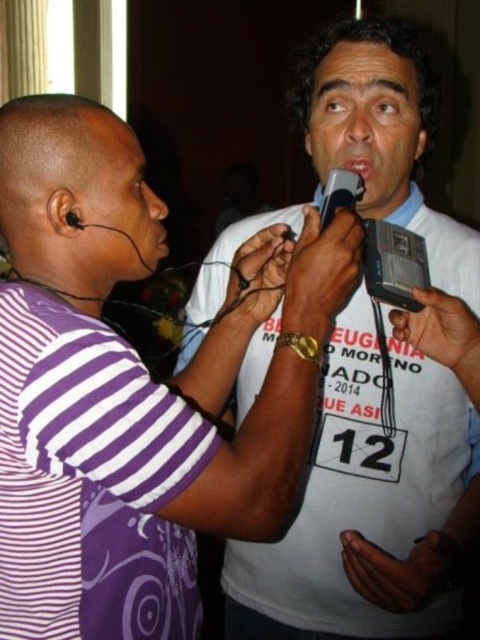
Question: Which object is the farthest from the white fabric shirt at center?

Choices:
 (A) white matte shirt at center
 (B) black plastic microphone at center

Answer: (B)

Question: Where is white matte shirt at center located in relation to black plastic microphone at center in the image?

Choices:
 (A) below
 (B) above

Answer: (A)

Question: Among these points, which one is farthest from the camera?

Choices:
 (A) click(x=108, y=227)
 (B) click(x=380, y=499)
 (C) click(x=324, y=208)

Answer: (B)

Question: Which point is closer to the camera?

Choices:
 (A) black plastic microphone at center
 (B) white fabric shirt at center
 (C) white matte shirt at center

Answer: (C)

Question: Is white matte shirt at center below white fabric shirt at center?

Choices:
 (A) no
 (B) yes

Answer: (B)

Question: Does white fabric shirt at center appear on the right side of black plastic microphone at center?

Choices:
 (A) no
 (B) yes

Answer: (A)